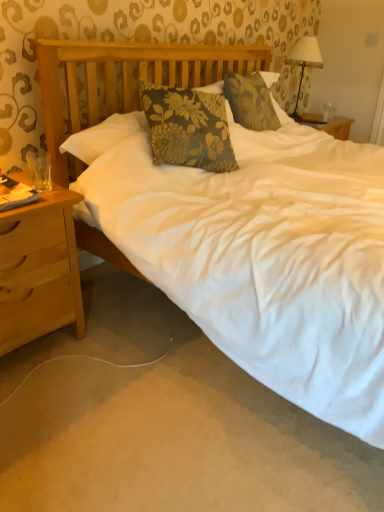
Question: Does white fabric lampshade at upper right have a lesser height compared to transparent glass at upper right?

Choices:
 (A) no
 (B) yes

Answer: (A)

Question: From the image's perspective, does white fabric lampshade at upper right appear higher than transparent glass at upper right?

Choices:
 (A) no
 (B) yes

Answer: (B)

Question: Considering the relative sizes of white fabric lampshade at upper right and transparent glass at upper right in the image provided, is white fabric lampshade at upper right smaller than transparent glass at upper right?

Choices:
 (A) yes
 (B) no

Answer: (B)

Question: Can you confirm if white fabric lampshade at upper right is thinner than transparent glass at upper right?

Choices:
 (A) yes
 (B) no

Answer: (B)

Question: From a real-world perspective, is white fabric lampshade at upper right located beneath transparent glass at upper right?

Choices:
 (A) no
 (B) yes

Answer: (A)

Question: Is white fabric lampshade at upper right in front of or behind transparent glass at upper right in the image?

Choices:
 (A) front
 (B) behind

Answer: (A)

Question: In terms of width, does white fabric lampshade at upper right look wider or thinner when compared to transparent glass at upper right?

Choices:
 (A) thin
 (B) wide

Answer: (B)

Question: Would you say white fabric lampshade at upper right is to the left or to the right of transparent glass at upper right in the picture?

Choices:
 (A) left
 (B) right

Answer: (A)

Question: Considering the positions of white fabric lampshade at upper right and transparent glass at upper right in the image, is white fabric lampshade at upper right taller or shorter than transparent glass at upper right?

Choices:
 (A) tall
 (B) short

Answer: (A)

Question: Based on their sizes in the image, would you say transparent glass at upper right is bigger or smaller than light brown wood nightstand at left?

Choices:
 (A) big
 (B) small

Answer: (B)

Question: Considering the positions of point (331, 103) and point (64, 289), is point (331, 103) closer or farther from the camera than point (64, 289)?

Choices:
 (A) farther
 (B) closer

Answer: (A)

Question: From a real-world perspective, is transparent glass at upper right positioned above or below light brown wood nightstand at left?

Choices:
 (A) below
 (B) above

Answer: (B)

Question: In the image, is transparent glass at upper right positioned in front of or behind light brown wood nightstand at left?

Choices:
 (A) front
 (B) behind

Answer: (B)

Question: From a real-world perspective, is light brown wood nightstand at left above or below transparent glass at upper right?

Choices:
 (A) below
 (B) above

Answer: (A)

Question: Is light brown wood nightstand at left taller or shorter than transparent glass at upper right?

Choices:
 (A) short
 (B) tall

Answer: (B)